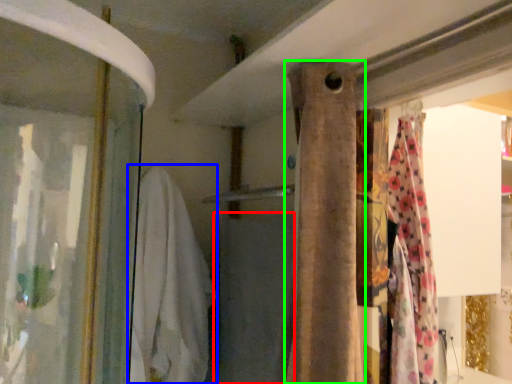
Question: Based on their relative distances, which object is nearer to bath towel (highlighted by a red box)? Choose from clothing (highlighted by a blue box) and curtain (highlighted by a green box).

Choices:
 (A) clothing
 (B) curtain

Answer: (A)